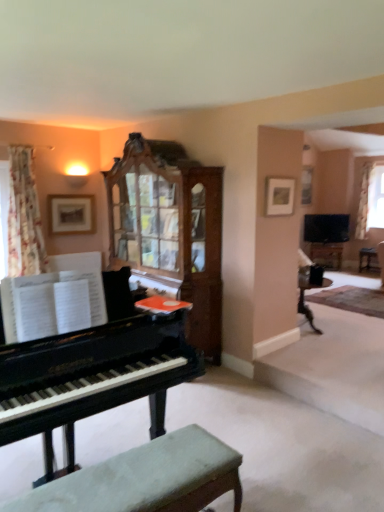
Measure the distance between point (x=32, y=190) and camera.

They are 4.92 meters apart.

In order to face green fabric bench at lower center, should I rotate leftwards or rightwards?

A 7.977 degree turn to the left will do.

Where is `wooden side table at right`? The image size is (384, 512). wooden side table at right is located at coordinates (368, 259).

Locate an element on the screen. Image resolution: width=384 pixels, height=512 pixels. flat-screen tv at upper right is located at coordinates (326, 228).

This screenshot has height=512, width=384. Identify the location of black polished piano at left. (93, 372).

Would you say flat-screen tv at upper right contains matte black table at right?

That's incorrect, matte black table at right is not inside flat-screen tv at upper right.

Is flat-screen tv at upper right oriented away from matte black table at right?

No.

Between flat-screen tv at upper right and matte black table at right, which one has less height?

matte black table at right.

Considering the positions of objects flat-screen tv at upper right and matte black table at right in the image provided, who is more to the right, flat-screen tv at upper right or matte black table at right?

Positioned to the right is flat-screen tv at upper right.

From the picture: Does green fabric bench at lower center have a smaller size compared to clear glass cabinet at upper center?

No.

Can clear glass cabinet at upper center be found inside green fabric bench at lower center?

That's incorrect, clear glass cabinet at upper center is not inside green fabric bench at lower center.

From a real-world perspective, does green fabric bench at lower center stand above clear glass cabinet at upper center?

No, from a real-world perspective, green fabric bench at lower center is not on top of clear glass cabinet at upper center.

Is green fabric bench at lower center to the left or to the right of clear glass cabinet at upper center in the image?

Based on their positions, green fabric bench at lower center is located to the left of clear glass cabinet at upper center.

Is wooden cabinet at upper center inside or outside of matte black table at right?

wooden cabinet at upper center is outside matte black table at right.

Does wooden cabinet at upper center appear on the left side of matte black table at right?

Yes, wooden cabinet at upper center is to the left of matte black table at right.

How much distance is there between wooden cabinet at upper center and matte black table at right?

wooden cabinet at upper center and matte black table at right are 3.50 meters apart from each other.

Consider the image. Is wooden cabinet at upper center directly adjacent to matte black table at right?

wooden cabinet at upper center and matte black table at right are not in contact.

From the image's perspective, relative to green fabric bench at lower center, is matte black table at right above or below?

matte black table at right is above green fabric bench at lower center.

Is matte black table at right behind green fabric bench at lower center?

Yes, matte black table at right is further from the camera.

Which object is positioned more to the right, matte black table at right or green fabric bench at lower center?

From the viewer's perspective, matte black table at right appears more on the right side.

How many degrees apart are the facing directions of matte black table at right and green fabric bench at lower center?

134 degrees separate the facing orientations of matte black table at right and green fabric bench at lower center.

Is clear glass cabinet at upper center facing towards matte wooden picture frame at upper center, placed as the 2th picture frame when sorted from back to front?

No, clear glass cabinet at upper center does not turn towards matte wooden picture frame at upper center, placed as the 2th picture frame when sorted from back to front.

From a real-world perspective, which is physically below, clear glass cabinet at upper center or matte wooden picture frame at upper center, the 2th picture frame viewed from the left?

clear glass cabinet at upper center, from a real-world perspective.

Is clear glass cabinet at upper center wider or thinner than matte wooden picture frame at upper center, the 2th picture frame viewed from the left?

In the image, clear glass cabinet at upper center appears to be wider than matte wooden picture frame at upper center, the 2th picture frame viewed from the left.

Would you say clear glass cabinet at upper center is outside matte wooden picture frame at upper center, acting as the 1th picture frame starting from the right?

Yes, clear glass cabinet at upper center is located beyond the bounds of matte wooden picture frame at upper center, acting as the 1th picture frame starting from the right.

Which object is thinner, wooden picture frame at upper left, the first picture frame from the left, or wooden cabinet at upper center?

wooden picture frame at upper left, the first picture frame from the left.

Consider the image. Between wooden picture frame at upper left, marked as the 1th picture frame in a back-to-front arrangement, and wooden cabinet at upper center, which one has larger size?

With larger size is wooden cabinet at upper center.

Is wooden picture frame at upper left, marked as the 1th picture frame in a back-to-front arrangement, to the left of wooden cabinet at upper center from the viewer's perspective?

Yes, wooden picture frame at upper left, marked as the 1th picture frame in a back-to-front arrangement, is to the left of wooden cabinet at upper center.

Is wooden picture frame at upper left, which is the second picture frame in right-to-left order, completely or partially outside of wooden cabinet at upper center?

wooden picture frame at upper left, which is the second picture frame in right-to-left order, lies outside wooden cabinet at upper center's area.

From the green fabric bench at lower center, count 1st curtains backward and point to it. Please provide its 2D coordinates.

[(24, 217)]

Is green fabric bench at lower center taller or shorter than floral fabric curtain at upper left, which is the 1th curtain from front to back?

green fabric bench at lower center is shorter than floral fabric curtain at upper left, which is the 1th curtain from front to back.

Is green fabric bench at lower center positioned behind floral fabric curtain at upper left, which is counted as the second curtain, starting from the right?

That is False.

From a real-world perspective, is green fabric bench at lower center positioned over floral fabric curtain at upper left, which is counted as the second curtain, starting from the right, based on gravity?

No, from a real-world perspective, green fabric bench at lower center is not over floral fabric curtain at upper left, which is counted as the second curtain, starting from the right

At what (x,y) coordinates should I click in order to perform the action: click on television on the right of matte black table at right. Please return your answer as a coordinate pair (x, y). This screenshot has width=384, height=512. Looking at the image, I should click on (326, 228).

Identify the location of chair below the clear glass cabinet at upper center (from the image's perspective). (146, 479).

Looking at the image, which one is located further to wooden side table at right, clear glass cabinet at upper center or white sheer curtain at upper right, acting as the first curtain starting from the right?

clear glass cabinet at upper center lies further to wooden side table at right than the other object.

From the image, which object appears to be nearer to wooden cabinet at upper center, clear glass cabinet at upper center or green fabric bench at lower center?

green fabric bench at lower center.

Based on their spatial positions, is white sheer curtain at upper right, which is the first curtain from back to front, or floral fabric curtain at upper left, which is counted as the 2th curtain, starting from the back, further from matte wooden picture frame at upper center, acting as the 1th picture frame starting from the right?

The object further to matte wooden picture frame at upper center, acting as the 1th picture frame starting from the right, is white sheer curtain at upper right, which is the first curtain from back to front.

Which object lies nearer to the anchor point black polished piano at left, green fabric bench at lower center or clear glass cabinet at upper center?

green fabric bench at lower center is positioned closer to the anchor black polished piano at left.

Based on their spatial positions, is white sheer curtain at upper right, which is the second curtain from front to back, or clear glass cabinet at upper center closer to matte wooden picture frame at upper center, the 2th picture frame viewed from the left?

Among the two, white sheer curtain at upper right, which is the second curtain from front to back, is located nearer to matte wooden picture frame at upper center, the 2th picture frame viewed from the left.

Consider the image. Looking at the image, which one is located closer to wooden side table at right, black polished piano at left or flat-screen tv at upper right?

Based on the image, flat-screen tv at upper right appears to be nearer to wooden side table at right.

When comparing their distances from black polished piano at left, does wooden picture frame at upper left, arranged as the second picture frame when viewed from the front, or clear glass cabinet at upper center seem further?

The object further to black polished piano at left is clear glass cabinet at upper center.

Estimate the real-world distances between objects in this image. Which object is further from wooden cabinet at upper center, black polished piano at left or flat-screen tv at upper right?

flat-screen tv at upper right is positioned further to the anchor wooden cabinet at upper center.

Locate an element on the screen. This screenshot has width=384, height=512. furniture positioned between green fabric bench at lower center and clear glass cabinet at upper center from near to far is located at coordinates (368, 259).

At what (x,y) coordinates should I click in order to perform the action: click on picture frame between wooden picture frame at upper left, arranged as the second picture frame when viewed from the front, and wooden side table at right, in the horizontal direction. Please return your answer as a coordinate pair (x, y). Image resolution: width=384 pixels, height=512 pixels. Looking at the image, I should click on (279, 196).

Where is `piano between green fabric bench at lower center and matte black table at right in the front-back direction`? The width and height of the screenshot is (384, 512). piano between green fabric bench at lower center and matte black table at right in the front-back direction is located at coordinates (93, 372).

Locate an element on the screen. This screenshot has width=384, height=512. curtain between green fabric bench at lower center and wooden side table at right in the front-back direction is located at coordinates (24, 217).